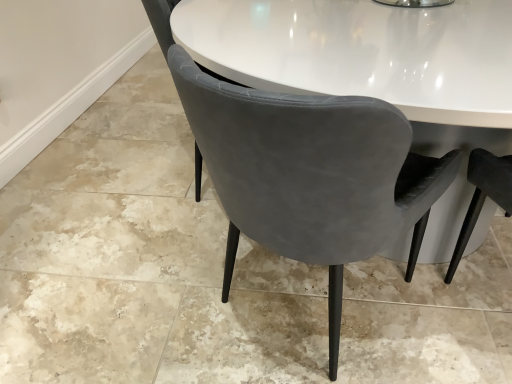
I want to click on vacant space underneath suede gray chair at center (from a real-world perspective), so [x=302, y=315].